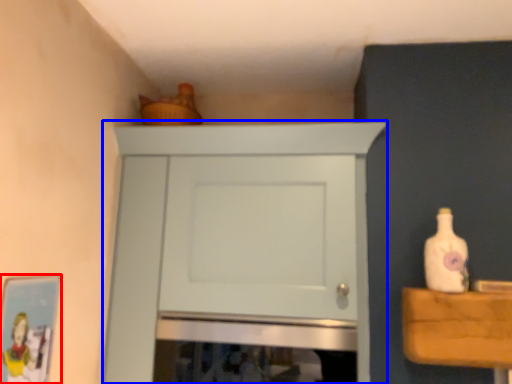
Question: Among these objects, which one is farthest to the camera, picture frame (highlighted by a red box) or cupboard (highlighted by a blue box)?

Choices:
 (A) picture frame
 (B) cupboard

Answer: (B)